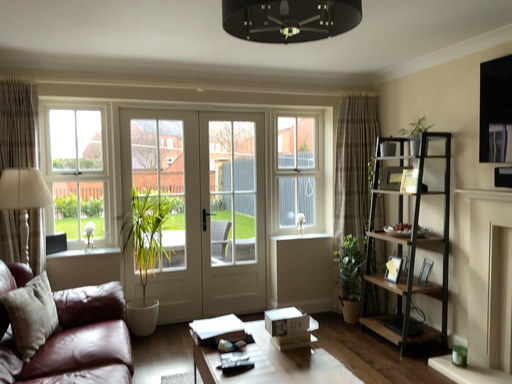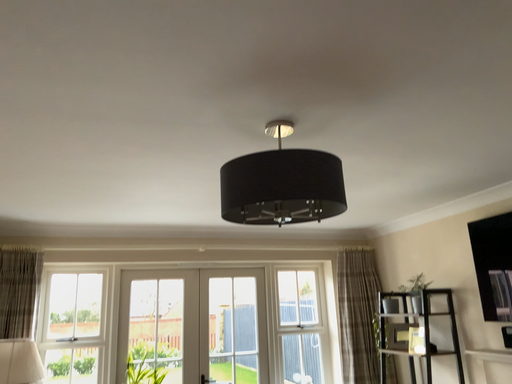
Question: Which way did the camera rotate in the video?

Choices:
 (A) rotated upward
 (B) rotated downward

Answer: (A)